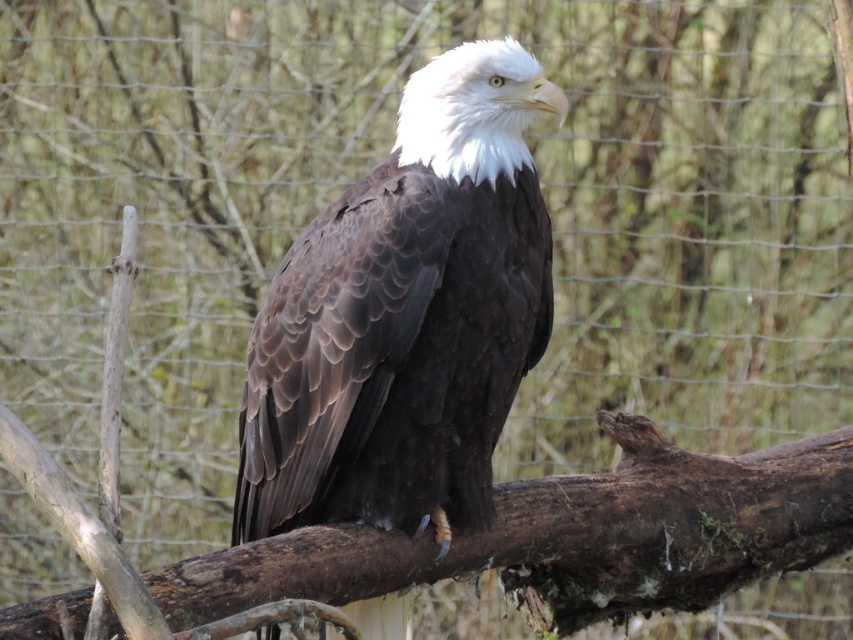
You are an ornithologist observing a bald eagle in its natural habitat. You notice the dark brown feathers at center and the brown rough wood at center. Which object is closer to your eyes?

The dark brown feathers at center is closer to your eyes because it is further to the viewer than the brown rough wood at center.